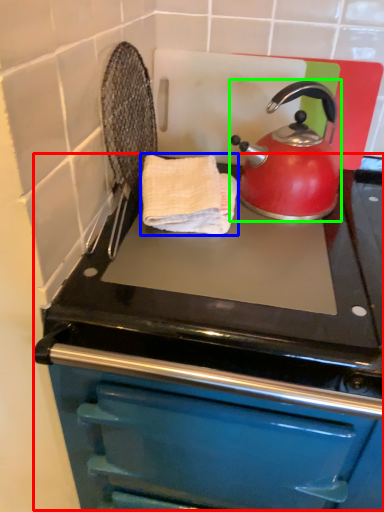
Question: Which object is the closest to the oven (highlighted by a red box)? Choose among these: hand towel (highlighted by a blue box) or kettle (highlighted by a green box).

Choices:
 (A) hand towel
 (B) kettle

Answer: (A)